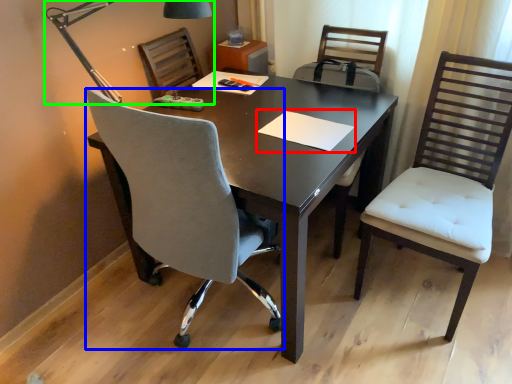
Question: Which is farther away from notepad (highlighted by a red box)? chair (highlighted by a blue box) or lamp (highlighted by a green box)?

Choices:
 (A) chair
 (B) lamp

Answer: (B)